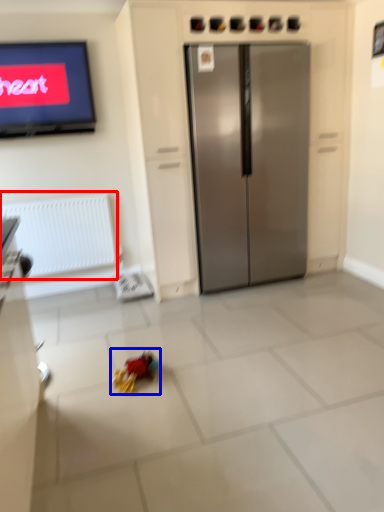
Question: Which object appears farthest to the camera in this image, radiator (highlighted by a red box) or miniature (highlighted by a blue box)?

Choices:
 (A) radiator
 (B) miniature

Answer: (A)